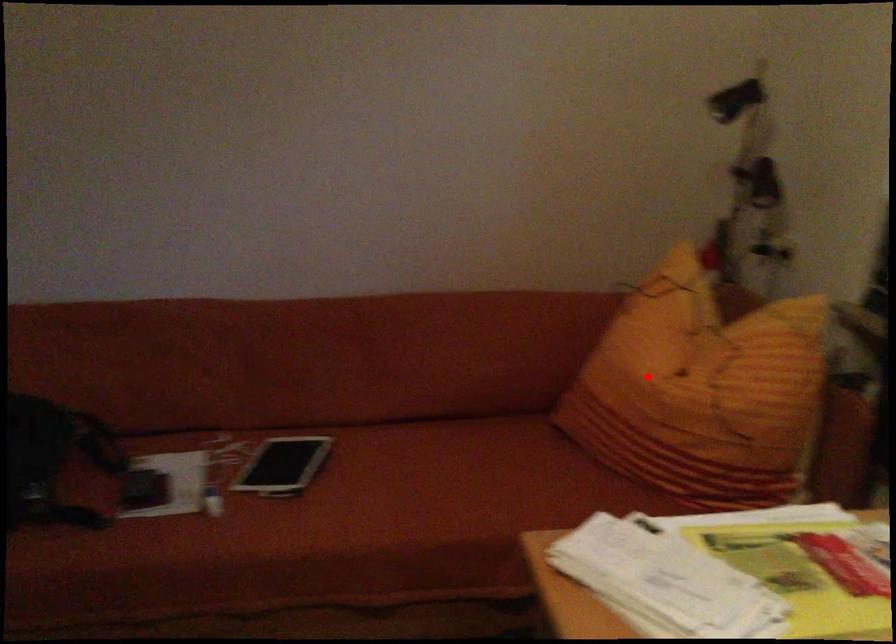
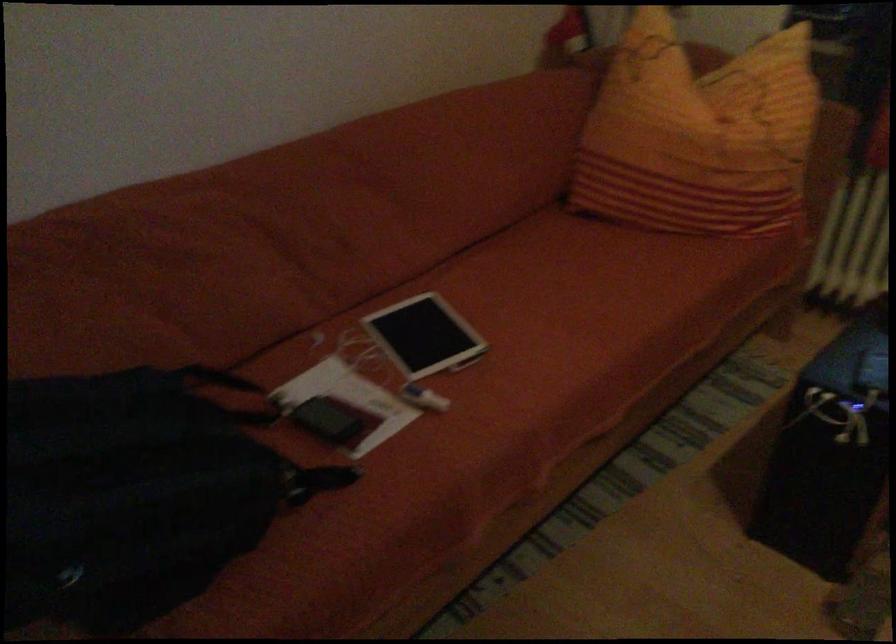
Where in the second image is the point corresponding to the highlighted location from the first image?

(698, 135)